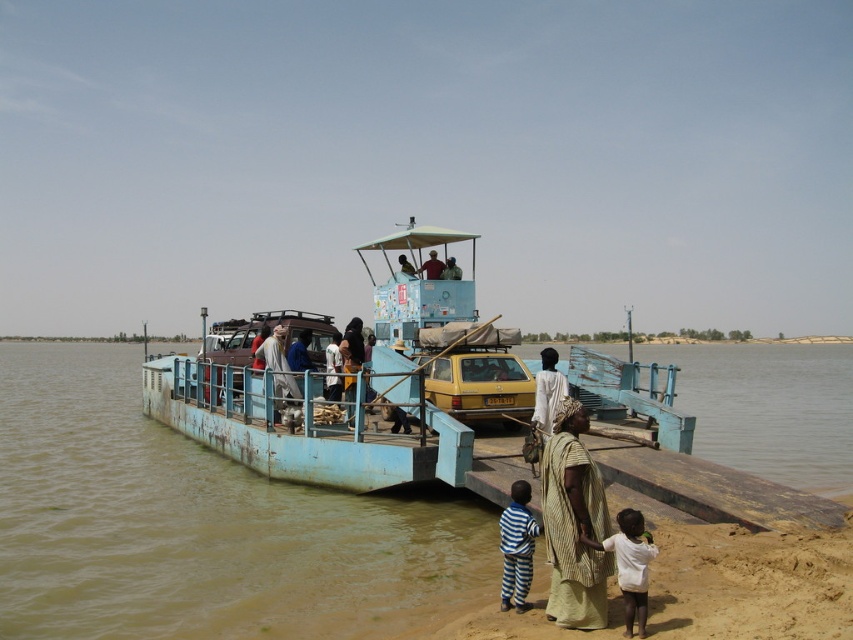
Looking at this image, who is positioned more to the left, light brown fabric headscarf at center or light brown wooden pole at upper center?

From the viewer's perspective, light brown fabric headscarf at center appears more on the left side.

Measure the distance from light brown fabric headscarf at center to light brown wooden pole at upper center.

light brown fabric headscarf at center and light brown wooden pole at upper center are 4.21 meters apart from each other.

What do you see at coordinates (280, 376) in the screenshot?
I see `light brown fabric headscarf at center` at bounding box center [280, 376].

Locate an element on the screen. The width and height of the screenshot is (853, 640). light brown fabric headscarf at center is located at coordinates (280, 376).

Is striped fabric pants at lower center to the right of light brown fabric headscarf at center from the viewer's perspective?

Yes, striped fabric pants at lower center is to the right of light brown fabric headscarf at center.

Who is more forward, [511,563] or [256,356]?

Point [511,563]

Find the location of a particular element. striped fabric pants at lower center is located at coordinates (517, 547).

Locate an element on the screen. This screenshot has width=853, height=640. striped fabric pants at lower center is located at coordinates (517, 547).

Does matte blue shirt at center lie behind light brown wooden chair at center?

Yes, it is.

Is matte blue shirt at center smaller than light brown wooden chair at center?

Correct, matte blue shirt at center occupies less space than light brown wooden chair at center.

Describe the element at coordinates (432, 266) in the screenshot. This screenshot has height=640, width=853. I see `matte blue shirt at center` at that location.

Where is `matte blue shirt at center`? matte blue shirt at center is located at coordinates (432, 266).